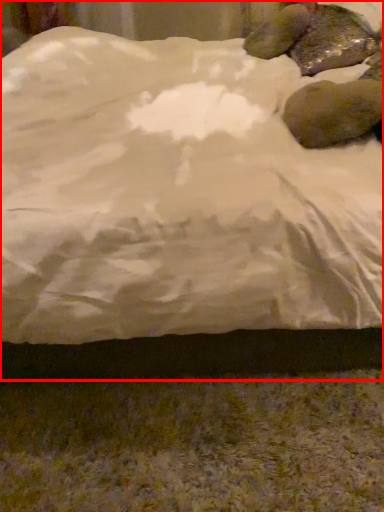
Question: From the image's perspective, what is the correct spatial relationship of bed (annotated by the red box) in relation to animal?

Choices:
 (A) above
 (B) below

Answer: (A)